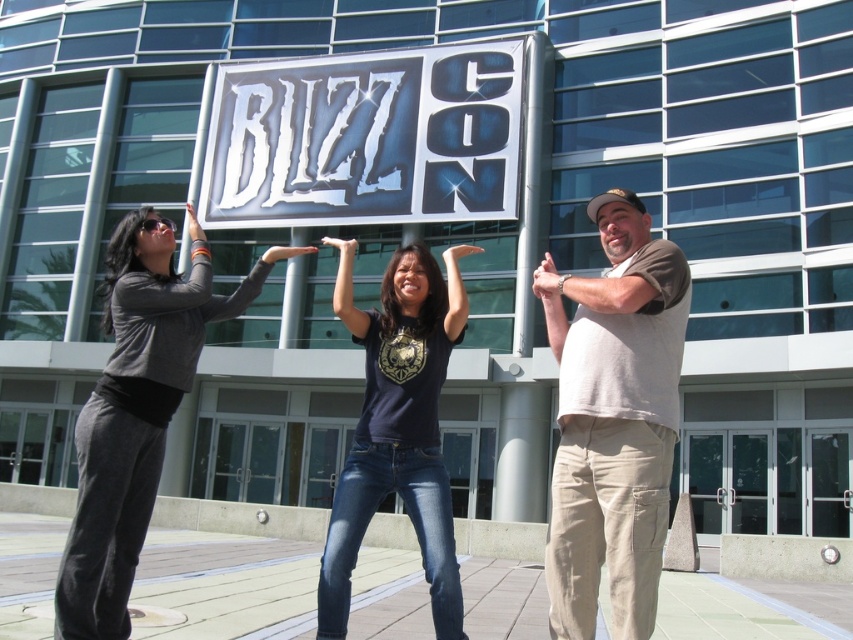
Measure the distance between metallic silver sign at center and black matte t-shirt at center.

metallic silver sign at center and black matte t-shirt at center are 26.05 meters apart from each other.

The image size is (853, 640). What do you see at coordinates (366, 138) in the screenshot? I see `metallic silver sign at center` at bounding box center [366, 138].

Identify the location of metallic silver sign at center. (366, 138).

Is metallic silver sign at center thinner than beige cotton pants at right?

In fact, metallic silver sign at center might be wider than beige cotton pants at right.

Does metallic silver sign at center have a greater width compared to beige cotton pants at right?

Indeed, metallic silver sign at center has a greater width compared to beige cotton pants at right.

Which is behind, point (215, 221) or point (639, 547)?

Point (215, 221)

Where is `metallic silver sign at center`? The image size is (853, 640). metallic silver sign at center is located at coordinates (366, 138).

Between point (660, 522) and point (451, 266), which one is positioned in front?

Point (660, 522) is in front.

Which is below, matte black shirt at center or black matte t-shirt at center?

black matte t-shirt at center is below.

Does point (383, 323) come farther from viewer compared to point (363, 454)?

Yes.

At what (x,y) coordinates should I click in order to perform the action: click on matte black shirt at center. Please return your answer as a coordinate pair (x, y). The height and width of the screenshot is (640, 853). Looking at the image, I should click on tap(393, 426).